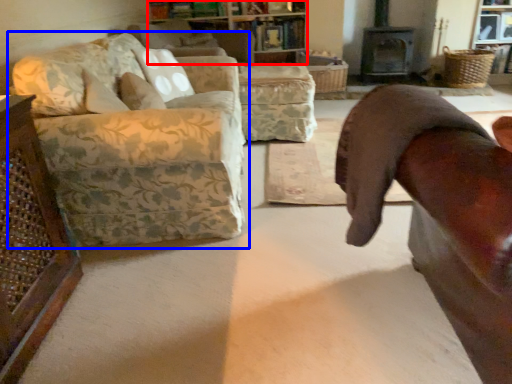
Question: Which object appears farthest to the camera in this image, cabinetry (highlighted by a red box) or studio couch (highlighted by a blue box)?

Choices:
 (A) cabinetry
 (B) studio couch

Answer: (A)